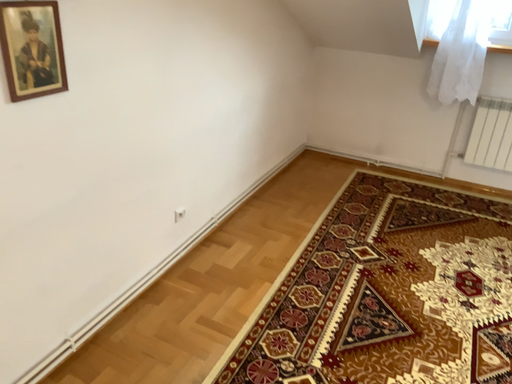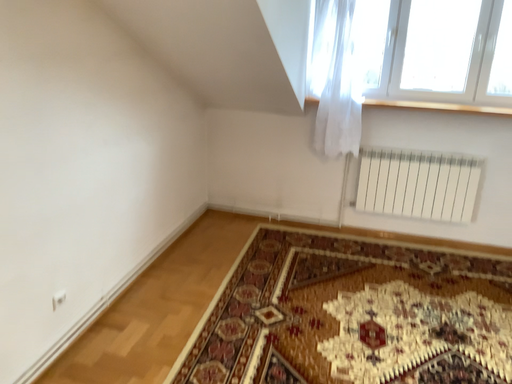
Question: Which way did the camera rotate in the video?

Choices:
 (A) rotated right
 (B) rotated left

Answer: (A)